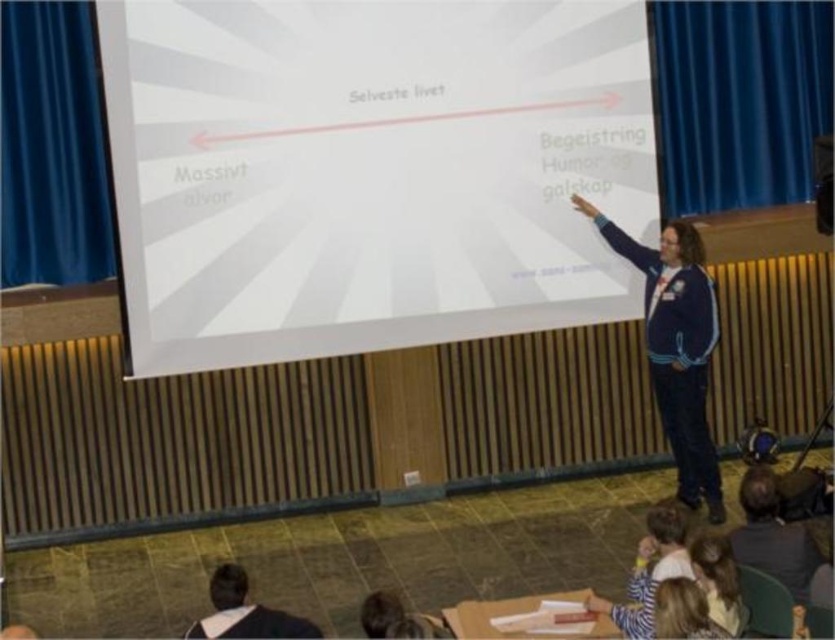
Describe the element at coordinates (676, 346) in the screenshot. The image size is (835, 640). I see `dark blue fleece jacket at right` at that location.

Does dark blue fleece jacket at right have a larger size compared to black fabric shirt at lower left?

Correct, dark blue fleece jacket at right is larger in size than black fabric shirt at lower left.

The image size is (835, 640). Identify the location of dark blue fleece jacket at right. [x=676, y=346].

The width and height of the screenshot is (835, 640). I want to click on dark blue fleece jacket at right, so click(x=676, y=346).

Is white matte projection screen at center smaller than dark gray sweater at lower right?

No.

Locate an element on the screen. white matte projection screen at center is located at coordinates (368, 172).

Does dark blue fleece jacket at right have a greater width compared to light brown hair at lower right?

Yes.

You are a GUI agent. You are given a task and a screenshot of the screen. Output one action in this format:
    pyautogui.click(x=<x>, y=<y>)
    Task: Click on the dark blue fleece jacket at right
    The image size is (835, 640).
    Given the screenshot: What is the action you would take?
    pyautogui.click(x=676, y=346)